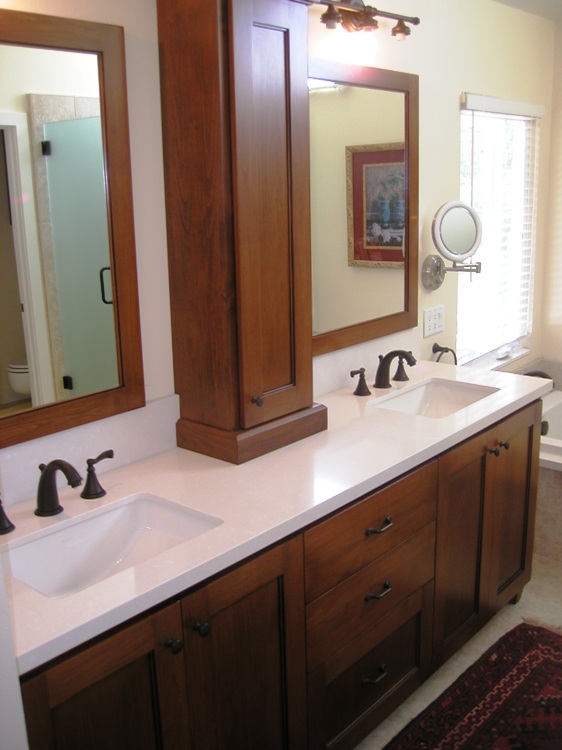
You are a GUI agent. You are given a task and a screenshot of the screen. Output one action in this format:
    pyautogui.click(x=<x>, y=<y>)
    Task: Click on the drawer handles
    This screenshot has width=562, height=750.
    Given the screenshot: What is the action you would take?
    pyautogui.click(x=377, y=529), pyautogui.click(x=380, y=592), pyautogui.click(x=379, y=676)